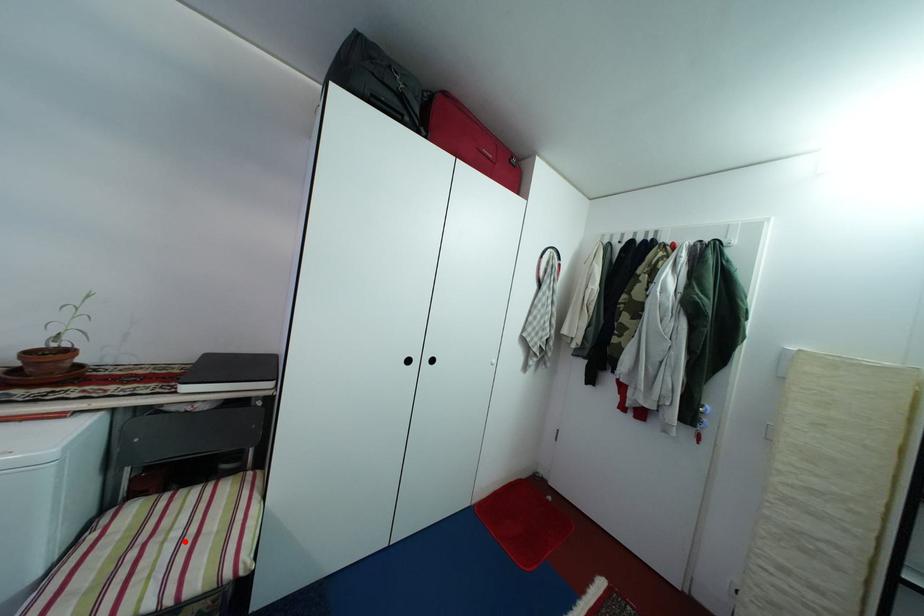
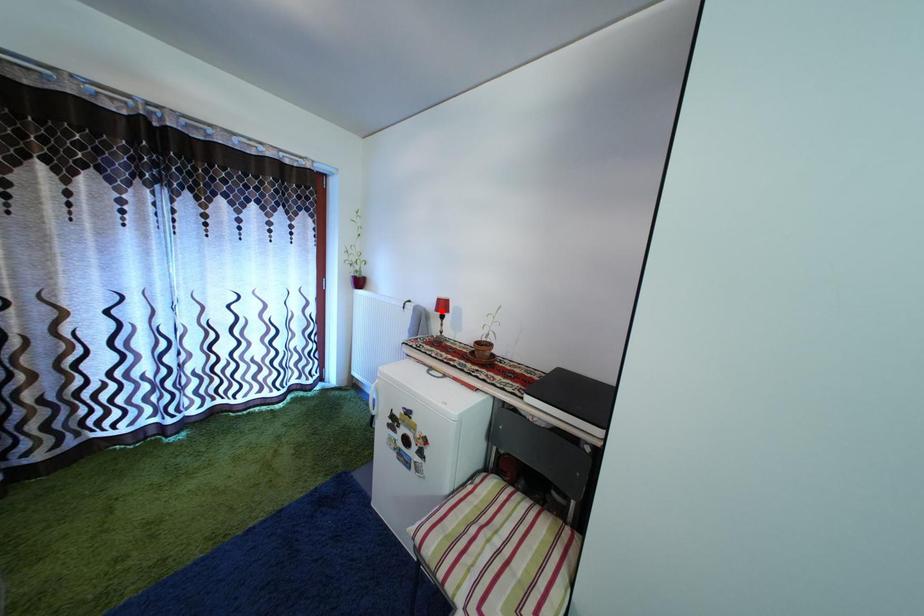
I am providing you with two images of the same scene from different viewpoints. A red point is marked on the first image and another point is marked on the second image. Is the marked point in image1 the same physical position as the marked point in image2?

No